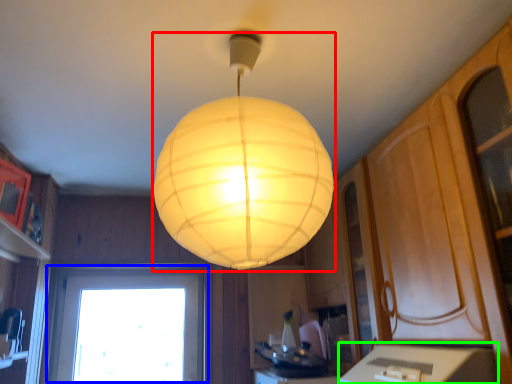
Question: Estimate the real-world distances between objects in this image. Which object is farther from lamp (highlighted by a red box), window (highlighted by a blue box) or counter top (highlighted by a green box)?

Choices:
 (A) window
 (B) counter top

Answer: (A)